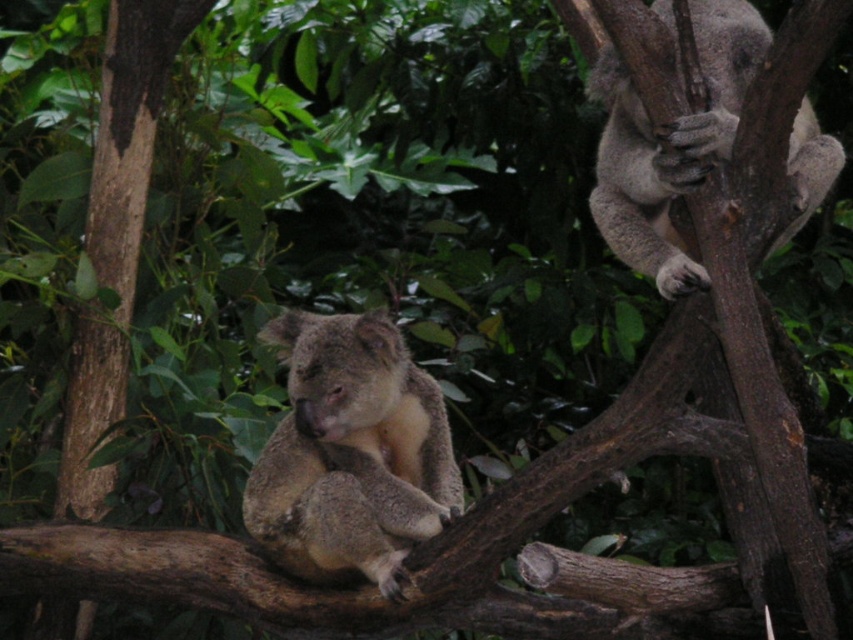
Who is higher up, fuzzy brown koala at center or fuzzy gray koala at upper right?

fuzzy gray koala at upper right is higher up.

Where is `fuzzy brown koala at center`? The image size is (853, 640). fuzzy brown koala at center is located at coordinates (351, 452).

Locate an element on the screen. The height and width of the screenshot is (640, 853). fuzzy brown koala at center is located at coordinates (351, 452).